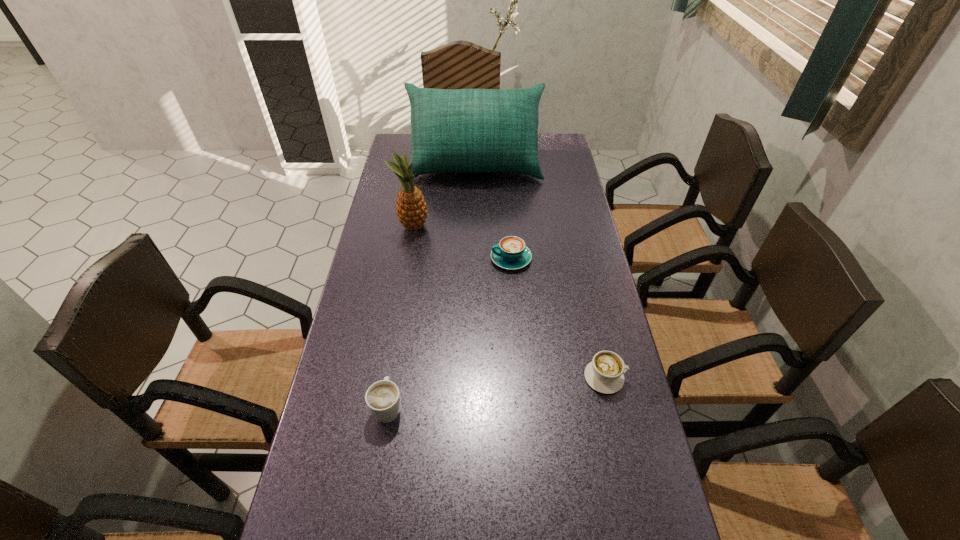
Locate an element on the screen. The height and width of the screenshot is (540, 960). free space between the fourth nearest object and the third shortest object is located at coordinates 400,317.

Locate an element on the screen. The image size is (960, 540). free space between the rightmost object and the leftmost cappuccino is located at coordinates (496, 392).

Find the location of a particular element. This screenshot has width=960, height=540. free area in between the third tallest object and the third farthest object is located at coordinates (449, 333).

Locate an element on the screen. This screenshot has width=960, height=540. empty space between the pineapple and the rightmost object is located at coordinates (509, 302).

At what (x,y) coordinates should I click in order to perform the action: click on vacant point located between the rightmost object and the third shortest object. Please return your answer as a coordinate pair (x, y). This screenshot has width=960, height=540. Looking at the image, I should click on (496, 392).

Select which object is the closest to the tallest cappuccino. Please provide its 2D coordinates. Your answer should be formatted as a tuple, i.e. [(x, y)], where the tuple contains the x and y coordinates of a point satisfying the conditions above.

[(605, 373)]

At what (x,y) coordinates should I click in order to perform the action: click on object that is the closest to the leftmost cappuccino. Please return your answer as a coordinate pair (x, y). Looking at the image, I should click on (605, 373).

Identify which cappuccino is located as the nearest to the leftmost cappuccino. Please provide its 2D coordinates. Your answer should be formatted as a tuple, i.e. [(x, y)], where the tuple contains the x and y coordinates of a point satisfying the conditions above.

[(605, 373)]

Identify the location of cappuccino that is the second closest to the leftmost cappuccino. This screenshot has height=540, width=960. [x=511, y=253].